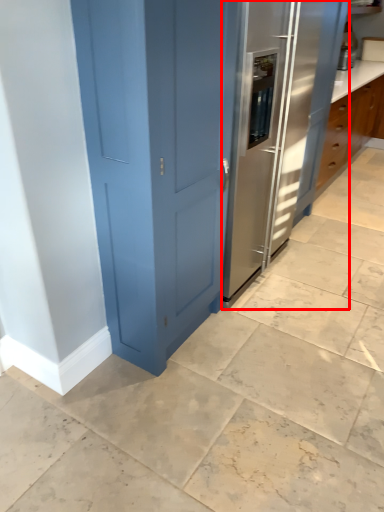
Question: From the image's perspective, where is fridge (annotated by the red box) located relative to appliance?

Choices:
 (A) below
 (B) above

Answer: (A)